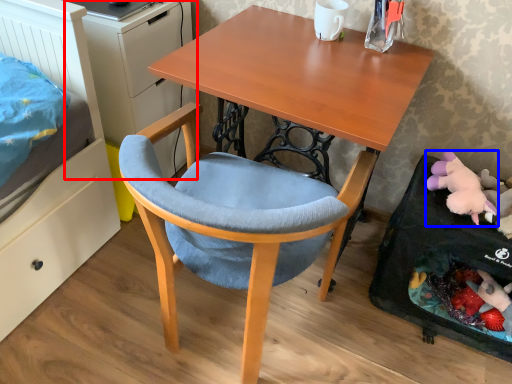
Question: Which of the following is the closest to the observer, dresser (highlighted by a red box) or toy (highlighted by a blue box)?

Choices:
 (A) dresser
 (B) toy

Answer: (B)